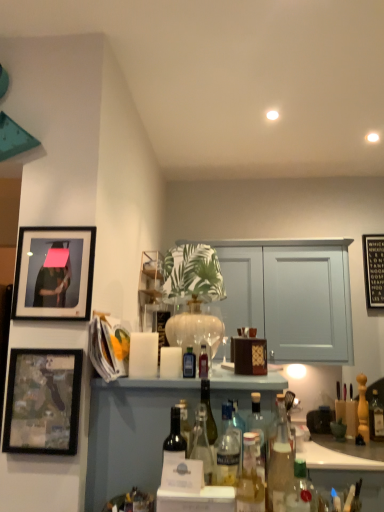
Question: Is clear glass bottle at center, the fourth bottle viewed from the right, in front of or behind translucent glass bottles at center in the image?

Choices:
 (A) front
 (B) behind

Answer: (A)

Question: Is clear glass bottle at center, the sixth bottle in the left-to-right sequence, situated inside translucent glass bottles at center or outside?

Choices:
 (A) inside
 (B) outside

Answer: (B)

Question: Which is farther from the dark glass bottle at center, placed as the second bottle when sorted from left to right?

Choices:
 (A) clear glass bottle at center, the 5th bottle positioned from the back
 (B) translucent glass bottle at center, the 5th bottle viewed from the left
 (C) clear glass bottle at center, which ranks as the sixth bottle in front-to-back order
 (D) wooden at upper center
 (E) translucent glass bottle at center, which is counted as the 4th bottle, starting from the front

Answer: (D)

Question: Which of these objects is positioned farthest from the clear glass bottle at center, which is counted as the third bottle, starting from the right?

Choices:
 (A) translucent glass bottle at center, which is the seventh bottle from right to left
 (B) translucent glass bottle at lower right, the 8th bottle viewed from the back
 (C) dark glass bottle at center, the 3th bottle in the front-to-back sequence
 (D) clear glass bottle at center, the 5th bottle positioned from the back
 (E) translucent glass bottles at center

Answer: (E)